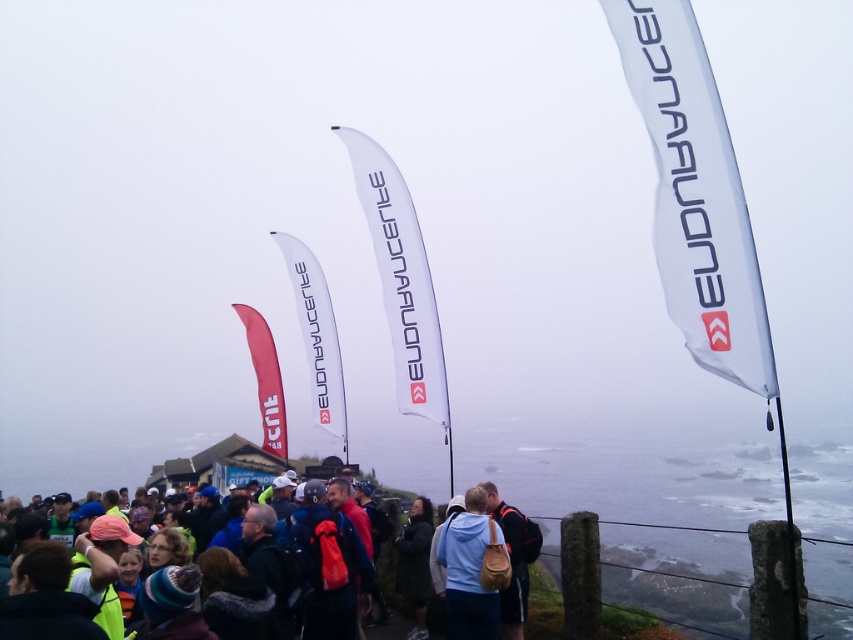
Question: Which of the following is the farthest from the observer?

Choices:
 (A) (474, 497)
 (B) (471, 589)

Answer: (A)

Question: Which of the following is the closest to the observer?

Choices:
 (A) light blue jacket at center
 (B) light blue fabric jacket at center

Answer: (B)

Question: Does light blue fabric jacket at center come behind light blue jacket at center?

Choices:
 (A) no
 (B) yes

Answer: (A)

Question: From the image, what is the correct spatial relationship of light blue fabric jacket at center in relation to light blue jacket at center?

Choices:
 (A) above
 (B) below

Answer: (A)

Question: Does light blue fabric jacket at center appear under light blue jacket at center?

Choices:
 (A) no
 (B) yes

Answer: (A)